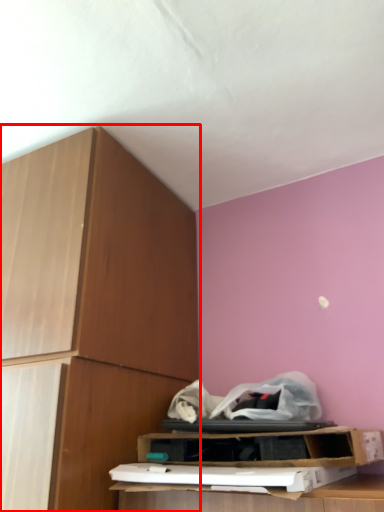
Question: From the image's perspective, what is the correct spatial positioning of cabinetry (annotated by the red box) in reference to shelf?

Choices:
 (A) above
 (B) below

Answer: (A)